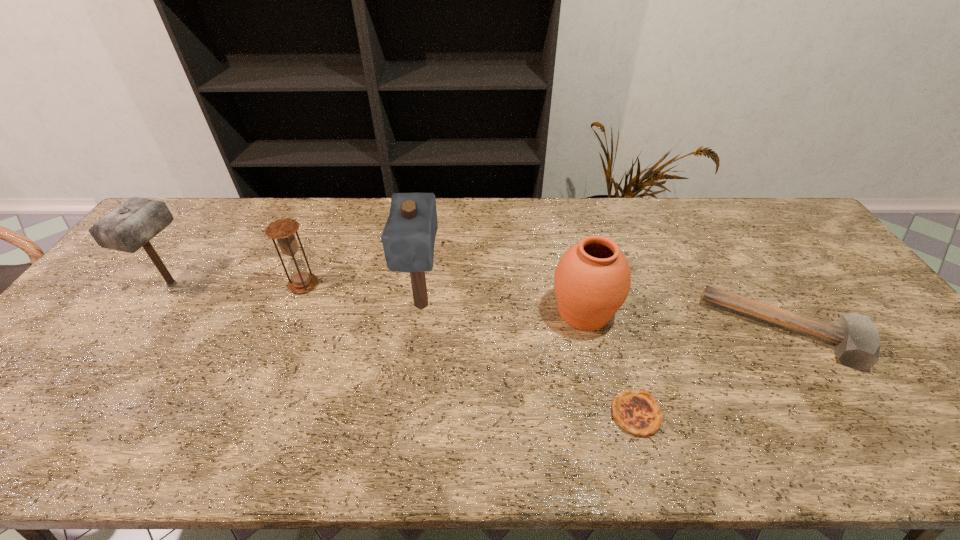
Find the location of a particular element. Image resolution: width=960 pixels, height=540 pixels. free space located 0.240m on the left of the urn is located at coordinates (462, 312).

You are a GUI agent. You are given a task and a screenshot of the screen. Output one action in this format:
    pyautogui.click(x=<x>, y=<y>)
    Task: Click on the vacant point located on the front of the fifth object from right to left
    
    Given the screenshot: What is the action you would take?
    pyautogui.click(x=276, y=349)

At what (x,y) coordinates should I click in order to perform the action: click on vacant space located on the left of the rightmost object. Please return your answer as a coordinate pair (x, y). Image resolution: width=960 pixels, height=540 pixels. Looking at the image, I should click on (600, 331).

This screenshot has width=960, height=540. What are the coordinates of `free space located 0.280m on the back of the shortest object` in the screenshot? It's located at (605, 304).

Locate an element on the screen. The height and width of the screenshot is (540, 960). object that is positioned at the near edge is located at coordinates (637, 412).

Find the location of a particular element. object that is at the left edge is located at coordinates (133, 224).

Locate an element on the screen. The image size is (960, 540). object that is at the right edge is located at coordinates (856, 340).

At what (x,y) coordinates should I click in order to perform the action: click on free space at the far edge. Please return your answer as a coordinate pair (x, y). The width and height of the screenshot is (960, 540). Looking at the image, I should click on (313, 225).

Where is `free space at the near edge`? free space at the near edge is located at coordinates (641, 448).

Image resolution: width=960 pixels, height=540 pixels. What are the coordinates of `vacant area at the left edge` in the screenshot? It's located at [x=32, y=367].